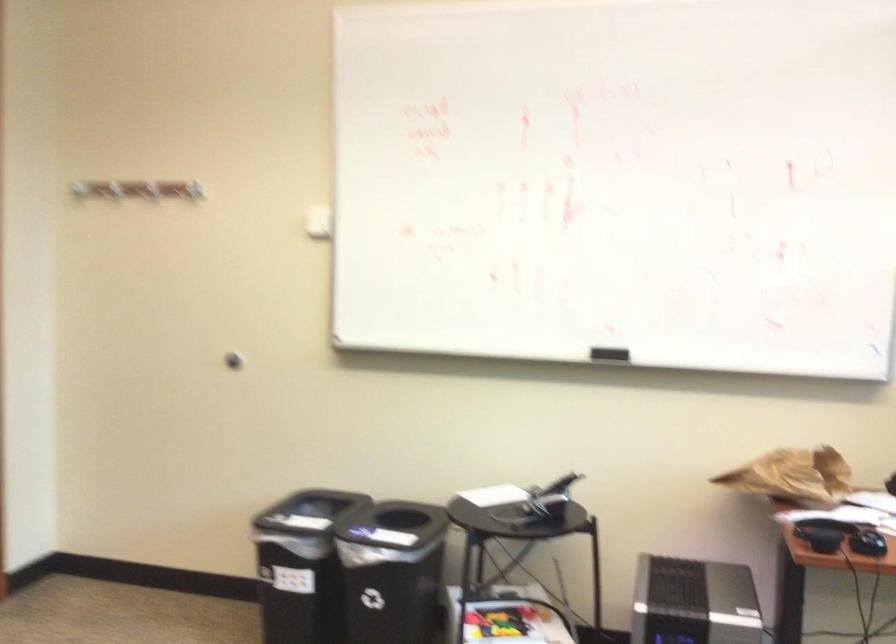
The width and height of the screenshot is (896, 644). Find the location of `white light switch`. white light switch is located at coordinates (317, 222).